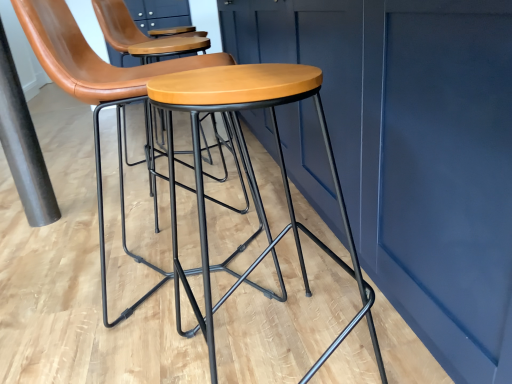
Question: Is black matte pole at left thinner than matte brown leather stool at center?

Choices:
 (A) no
 (B) yes

Answer: (B)

Question: From a real-world perspective, is black matte pole at left located higher than matte brown leather stool at center?

Choices:
 (A) no
 (B) yes

Answer: (A)

Question: Can you confirm if black matte pole at left is taller than matte brown leather stool at center?

Choices:
 (A) no
 (B) yes

Answer: (A)

Question: Considering the relative positions of black matte pole at left and matte brown leather stool at center in the image provided, is black matte pole at left to the right of matte brown leather stool at center from the viewer's perspective?

Choices:
 (A) yes
 (B) no

Answer: (B)

Question: From a real-world perspective, is black matte pole at left physically below matte brown leather stool at center?

Choices:
 (A) no
 (B) yes

Answer: (B)

Question: Considering the relative sizes of black matte pole at left and matte brown leather stool at center in the image provided, is black matte pole at left bigger than matte brown leather stool at center?

Choices:
 (A) no
 (B) yes

Answer: (A)

Question: Is matte brown leather stool at center positioned with its back to black matte pole at left?

Choices:
 (A) yes
 (B) no

Answer: (B)

Question: Can you confirm if matte brown leather stool at center is smaller than black matte pole at left?

Choices:
 (A) no
 (B) yes

Answer: (A)

Question: Does matte brown leather stool at center have a greater height compared to black matte pole at left?

Choices:
 (A) yes
 (B) no

Answer: (A)

Question: From a real-world perspective, is matte brown leather stool at center physically above black matte pole at left?

Choices:
 (A) no
 (B) yes

Answer: (B)

Question: Is matte brown leather stool at center thinner than black matte pole at left?

Choices:
 (A) no
 (B) yes

Answer: (A)

Question: Is matte brown leather stool at center wider than black matte pole at left?

Choices:
 (A) no
 (B) yes

Answer: (B)

Question: Is black matte pole at left positioned behind matte wood stool at center?

Choices:
 (A) no
 (B) yes

Answer: (B)